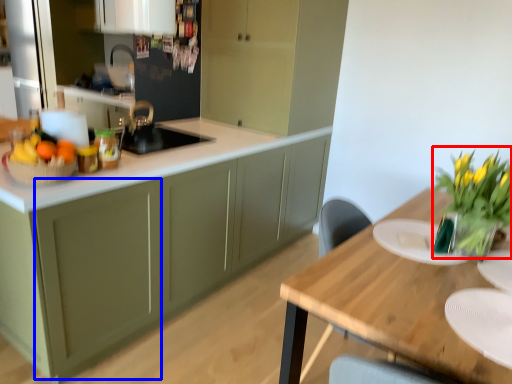
Question: Which point is closer to the camera, floral arrangement (highlighted by a red box) or cabinetry (highlighted by a blue box)?

Choices:
 (A) floral arrangement
 (B) cabinetry

Answer: (A)